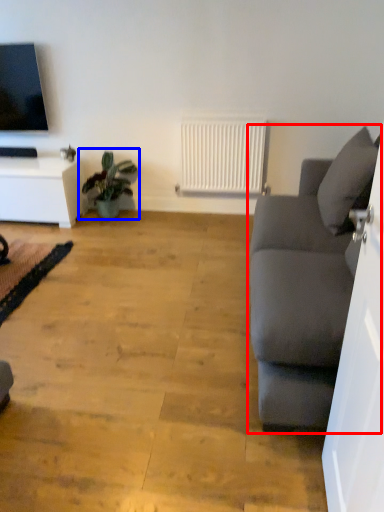
Question: Which of the following is the closest to the observer, studio couch (highlighted by a red box) or houseplant (highlighted by a blue box)?

Choices:
 (A) studio couch
 (B) houseplant

Answer: (A)